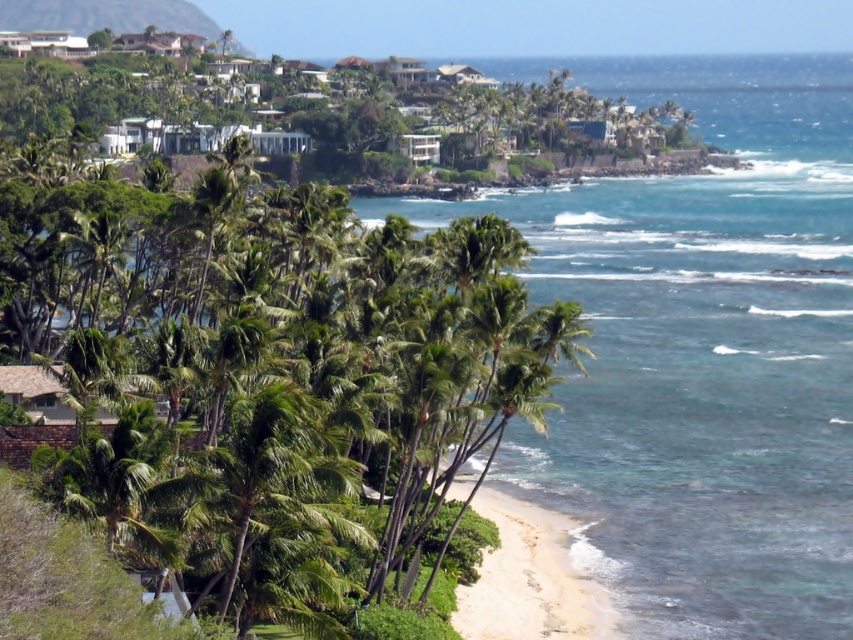
Can you confirm if clear blue water at center is shorter than white sand beach at lower center?

No.

Is point (654, 609) more distant than point (595, 602)?

That is False.

Is point (778, 161) positioned in front of point (590, 593)?

No, it is behind (590, 593).

Identify the location of clear blue water at center. Image resolution: width=853 pixels, height=640 pixels. (695, 390).

Does green leafy palm tree at center have a greater height compared to clear blue water at center?

In fact, green leafy palm tree at center may be shorter than clear blue water at center.

Describe the element at coordinates (273, 376) in the screenshot. The height and width of the screenshot is (640, 853). I see `green leafy palm tree at center` at that location.

Which is in front, point (440, 426) or point (694, 380)?

Point (440, 426) is more forward.

At what (x,y) coordinates should I click in order to perform the action: click on green leafy palm tree at center. Please return your answer as a coordinate pair (x, y). Looking at the image, I should click on (273, 376).

Is green leafy palm tree at center above white sand beach at lower center?

Indeed, green leafy palm tree at center is positioned over white sand beach at lower center.

I want to click on green leafy palm tree at center, so click(x=273, y=376).